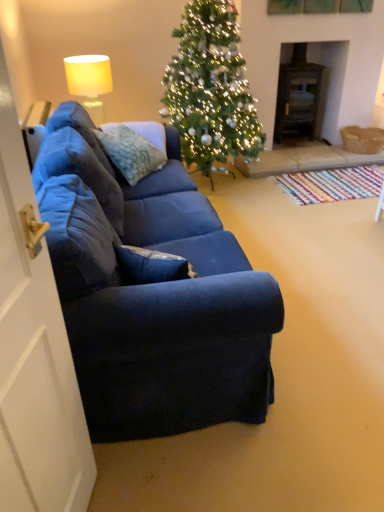
You are a GUI agent. You are given a task and a screenshot of the screen. Output one action in this format:
    pyautogui.click(x=<x>, y=<y>)
    Task: Click on the vacant area that is situated to the right of white matte door at left
    The width and height of the screenshot is (384, 512).
    Given the screenshot: What is the action you would take?
    pyautogui.click(x=144, y=488)